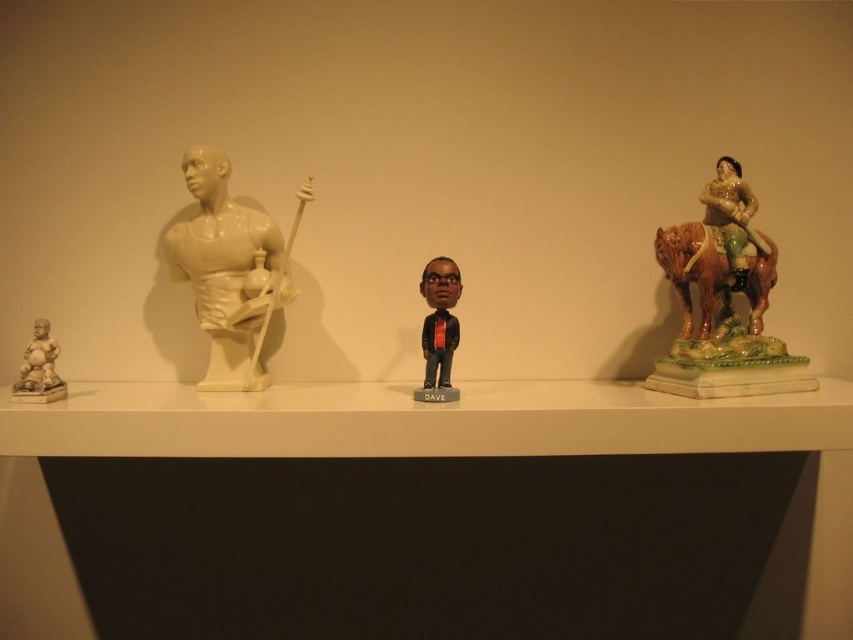
Which is more to the left, glazed ceramic figure at right or matte beige statue at left?

From the viewer's perspective, matte beige statue at left appears more on the left side.

Describe the element at coordinates (732, 218) in the screenshot. I see `glazed ceramic figure at right` at that location.

Find the location of a particular element. The width and height of the screenshot is (853, 640). glazed ceramic figure at right is located at coordinates (732, 218).

Does point (738, 237) come closer to viewer compared to point (436, 300)?

That is False.

Where is `glazed ceramic figure at right`? This screenshot has width=853, height=640. glazed ceramic figure at right is located at coordinates (732, 218).

You are a GUI agent. You are given a task and a screenshot of the screen. Output one action in this format:
    pyautogui.click(x=<x>, y=<y>)
    Task: Click on the glazed ceramic figure at right
    Image resolution: width=853 pixels, height=640 pixels.
    Given the screenshot: What is the action you would take?
    pyautogui.click(x=732, y=218)

Between point (437, 419) and point (428, 292), which one is positioned behind?

Positioned behind is point (428, 292).

Is white glossy shelf at center shorter than matte black bobblehead at center?

Correct, white glossy shelf at center is not as tall as matte black bobblehead at center.

Which is in front, point (254, 397) or point (434, 381)?

Point (254, 397) is in front.

Image resolution: width=853 pixels, height=640 pixels. Identify the location of white glossy shelf at center. (418, 420).